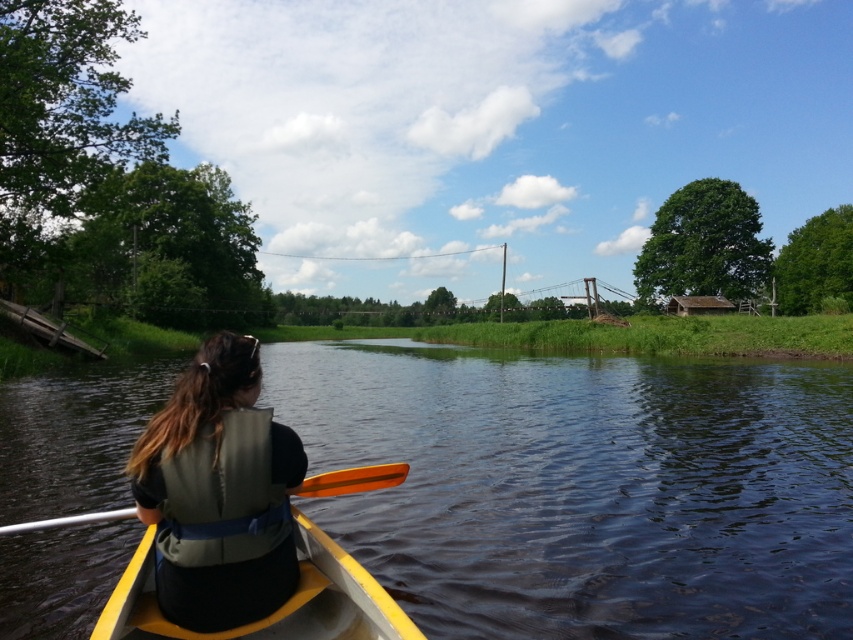
Which of these two, green smooth water at center or gray fabric life vest at left, stands shorter?

Standing shorter between the two is green smooth water at center.

Is green smooth water at center smaller than gray fabric life vest at left?

No, green smooth water at center is not smaller than gray fabric life vest at left.

Who is more forward, (16, 563) or (207, 600)?

Positioned in front is point (207, 600).

Locate an element on the screen. Image resolution: width=853 pixels, height=640 pixels. green smooth water at center is located at coordinates (584, 486).

Which is more to the left, gray fabric life vest at left or yellow plastic canoe at lower center?

From the viewer's perspective, gray fabric life vest at left appears more on the left side.

Does gray fabric life vest at left appear under yellow plastic canoe at lower center?

Actually, gray fabric life vest at left is above yellow plastic canoe at lower center.

What do you see at coordinates (218, 492) in the screenshot?
I see `gray fabric life vest at left` at bounding box center [218, 492].

Identify the location of gray fabric life vest at left. (218, 492).

Can you confirm if gray fabric life vest at left is positioned above orange wood paddle at center?

No, gray fabric life vest at left is not above orange wood paddle at center.

Can you confirm if gray fabric life vest at left is thinner than orange wood paddle at center?

In fact, gray fabric life vest at left might be wider than orange wood paddle at center.

What are the coordinates of `gray fabric life vest at left` in the screenshot? It's located at (218, 492).

You are a GUI agent. You are given a task and a screenshot of the screen. Output one action in this format:
    pyautogui.click(x=<x>, y=<y>)
    Task: Click on the gray fabric life vest at left
    This screenshot has height=640, width=853.
    Given the screenshot: What is the action you would take?
    pyautogui.click(x=218, y=492)